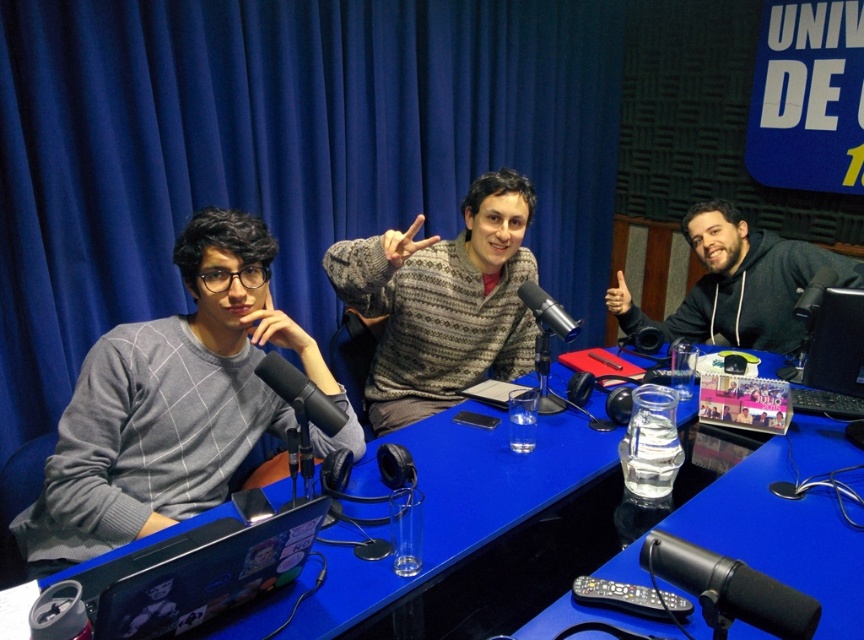
Question: Which object is closer to the camera taking this photo?

Choices:
 (A) black matte microphone at lower right
 (B) transparent glass water at center
 (C) gray sweater at left

Answer: (A)

Question: Which object is positioned farthest from the black matte microphone at lower right?

Choices:
 (A) black plastic monitor at center right
 (B) black hoodie at right
 (C) black matte microphone at right
 (D) matte black microphone at center

Answer: (B)

Question: In this image, where is gray sweater at left located relative to transparent glass water at center?

Choices:
 (A) right
 (B) left

Answer: (B)

Question: Among these objects, which one is farthest from the camera?

Choices:
 (A) transparent glass water at center
 (B) black matte microphone at center
 (C) black hoodie at right
 (D) black matte microphone at lower right

Answer: (C)

Question: Can you confirm if transparent glass water at center is positioned above matte black laptop at left?

Choices:
 (A) no
 (B) yes

Answer: (B)

Question: Where is blue glossy table at center located in relation to gray sweater at left in the image?

Choices:
 (A) left
 (B) right

Answer: (B)